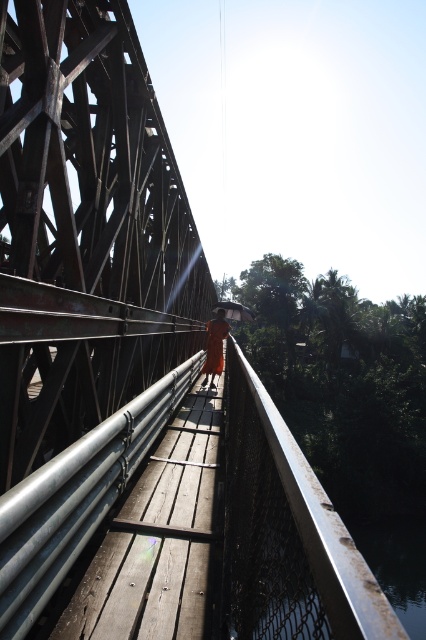
Based on the photo, you are standing on the wooden bridge described in the scene. You see the rusty metal river at lower center and the orange cloth at center. Which object is positioned lower in the scene?

The rusty metal river at lower center is located below the orange cloth at center, so it is positioned lower in the scene.